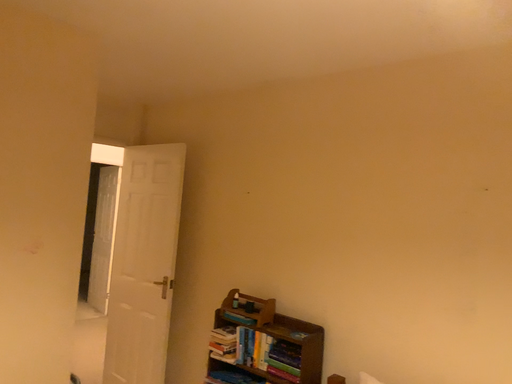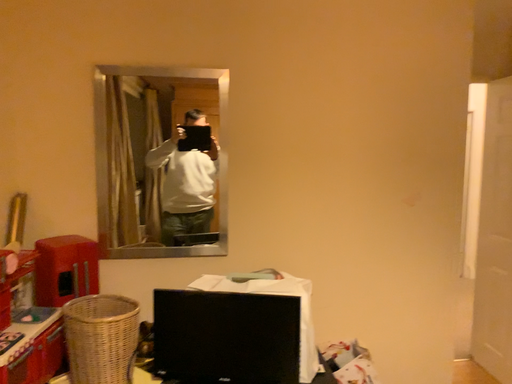
Question: Which way did the camera rotate in the video?

Choices:
 (A) rotated downward
 (B) rotated upward

Answer: (A)